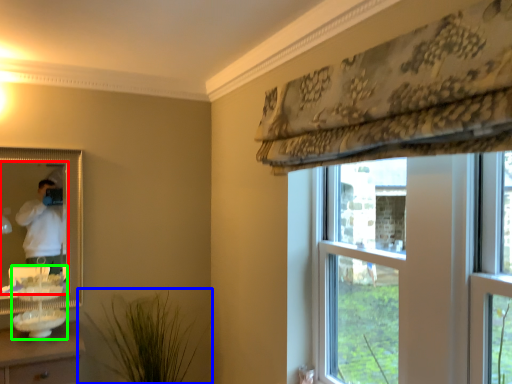
Question: Which object is positioned farthest from mirror (highlighted by a red box)? Select from houseplant (highlighted by a blue box) and sink (highlighted by a green box).

Choices:
 (A) houseplant
 (B) sink

Answer: (A)